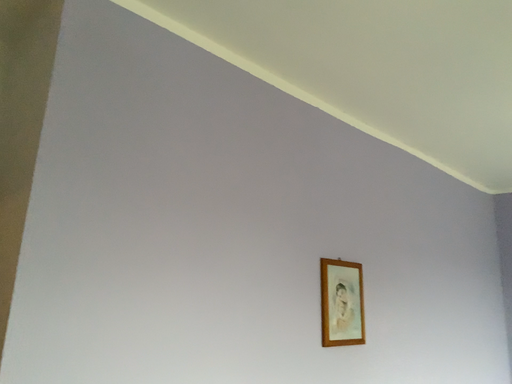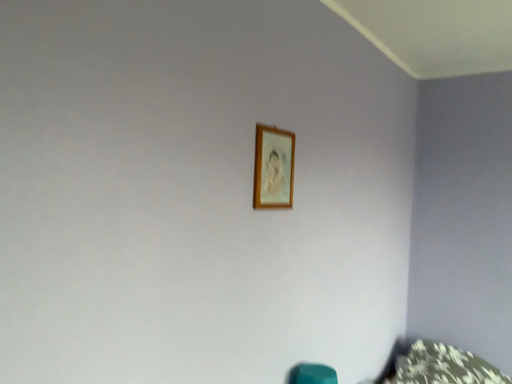
Question: How did the camera likely rotate when shooting the video?

Choices:
 (A) rotated right
 (B) rotated left

Answer: (A)